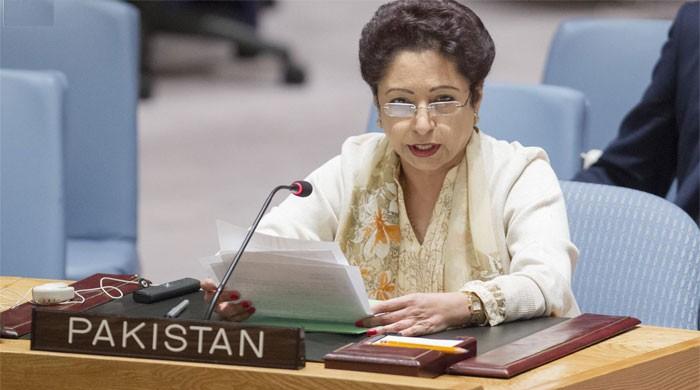
Find the location of a particular element. This screenshot has height=390, width=700. pen is located at coordinates (178, 310).